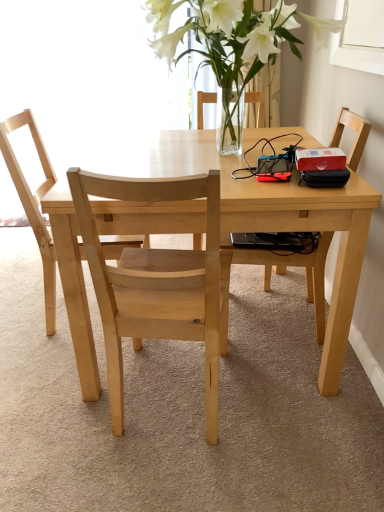
This screenshot has width=384, height=512. I want to click on free space in front of natural wood chair at center, the 1th chair viewed from the left, so click(x=44, y=381).